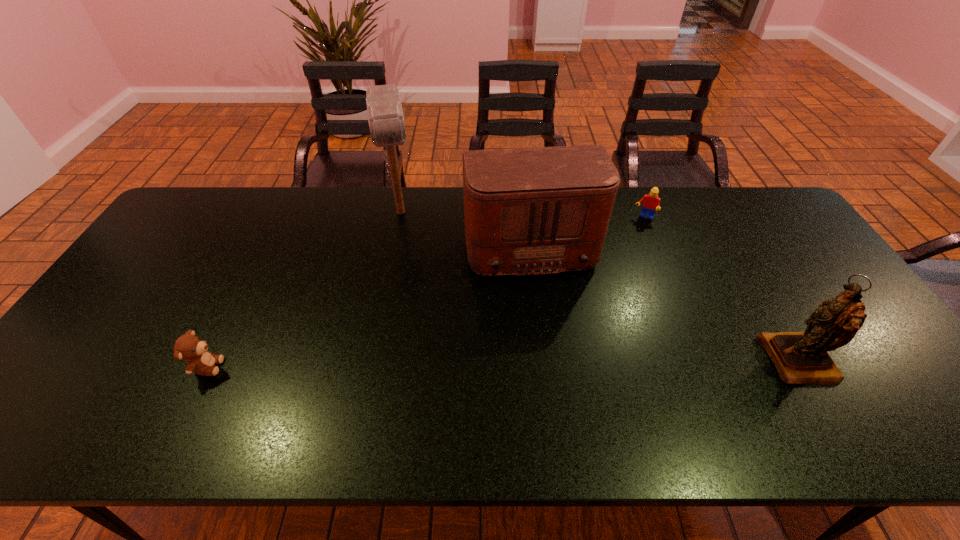
What are the coordinates of `the leftmost object` in the screenshot? It's located at (189, 347).

Locate an element on the screen. Image resolution: width=960 pixels, height=540 pixels. the rightmost object is located at coordinates (801, 357).

The height and width of the screenshot is (540, 960). Find the location of `the third object from right to left`. the third object from right to left is located at coordinates click(x=527, y=211).

This screenshot has width=960, height=540. In order to click on mallet in this screenshot , I will do `click(385, 116)`.

The width and height of the screenshot is (960, 540). What are the coordinates of `the tallest object` in the screenshot? It's located at (385, 116).

At what (x,y) coordinates should I click in order to perform the action: click on Lego. Please return your answer as a coordinate pair (x, y). Looking at the image, I should click on (652, 202).

The width and height of the screenshot is (960, 540). I want to click on vacant space located 0.180m on the face of the leftmost object, so click(297, 367).

Where is `vacant region located 0.340m on the front-facing side of the rightmost object`? vacant region located 0.340m on the front-facing side of the rightmost object is located at coordinates (628, 361).

Find the location of a particular element. The height and width of the screenshot is (540, 960). free space located on the front-facing side of the rightmost object is located at coordinates (685, 361).

Locate an element on the screen. free location located 0.130m on the front-facing side of the rightmost object is located at coordinates (714, 361).